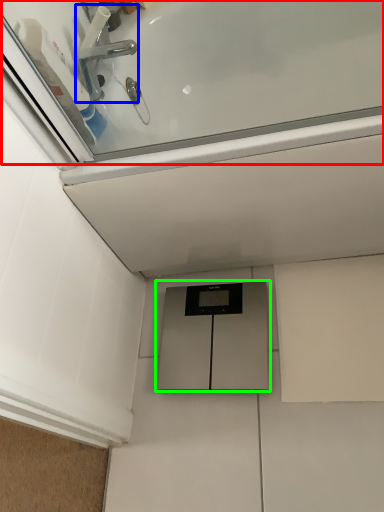
Question: Which is farther away from bath (highlighted by a red box)? tap (highlighted by a blue box) or cabinetry (highlighted by a green box)?

Choices:
 (A) tap
 (B) cabinetry

Answer: (B)